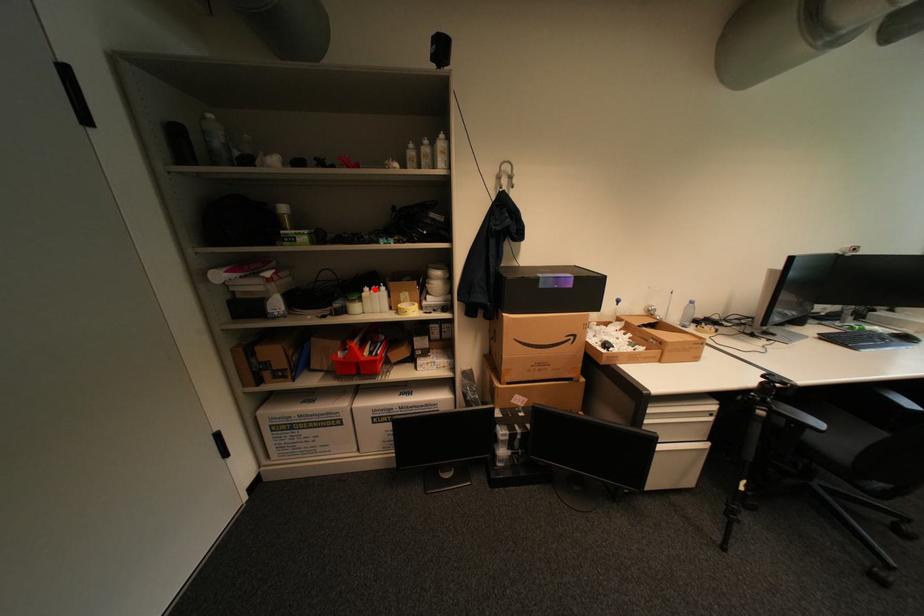
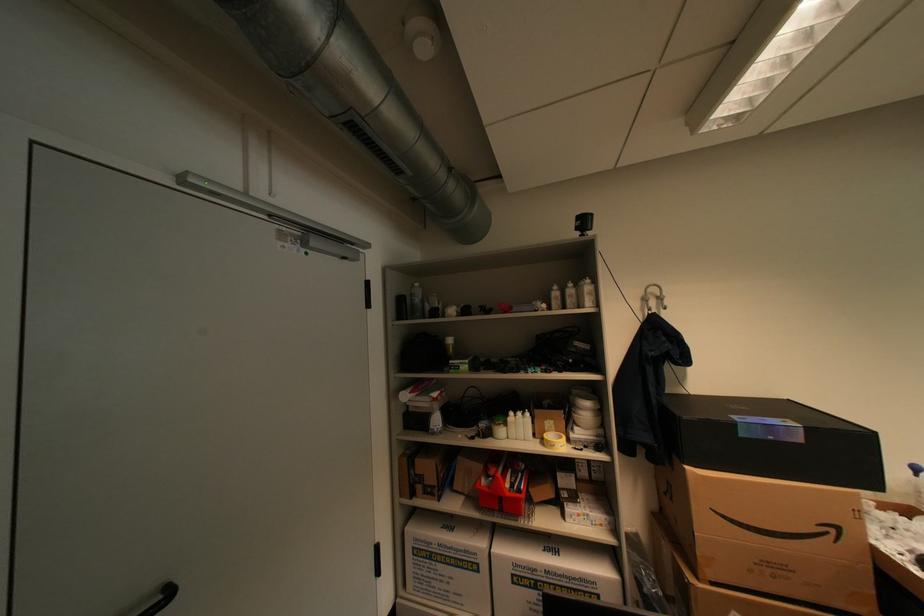
Locate, in the second image, the point that corresponds to the highlighted location in the first image.

(519, 414)